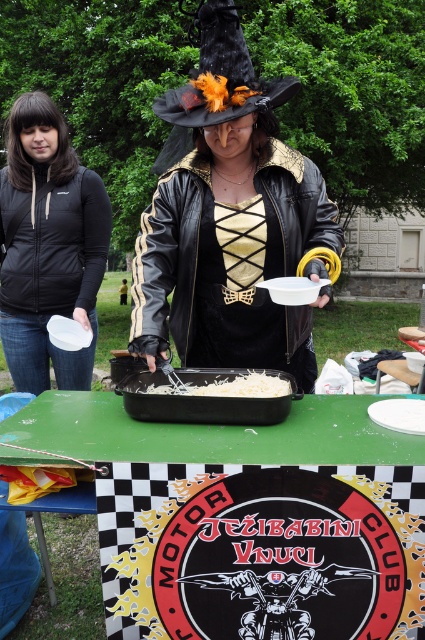
Is green plastic table at center closer to the viewer compared to black matte jacket at upper left?

Yes, it is.

Can you confirm if green plastic table at center is positioned to the right of black matte jacket at upper left?

Correct, you'll find green plastic table at center to the right of black matte jacket at upper left.

Who is more forward, (169,486) or (65,282)?

Point (169,486)

Find the location of `green plastic table at center`. green plastic table at center is located at coordinates (246, 520).

Is green plastic table at center positioned behind leather jacket at center?

No, it is not.

Is green plastic table at center to the right of leather jacket at center from the viewer's perspective?

Incorrect, green plastic table at center is not on the right side of leather jacket at center.

Is point (289, 481) positioned after point (294, 228)?

No, it is not.

Locate an element on the screen. green plastic table at center is located at coordinates (246, 520).

Who is more forward, (169, 234) or (181, 392)?

Point (181, 392) is in front.

Does point (195, 308) come closer to viewer compared to point (229, 385)?

No, (195, 308) is further to viewer.

Who is more forward, (229, 198) or (226, 385)?

Point (226, 385)

Where is `leather jacket at center`? This screenshot has height=640, width=425. leather jacket at center is located at coordinates (231, 262).